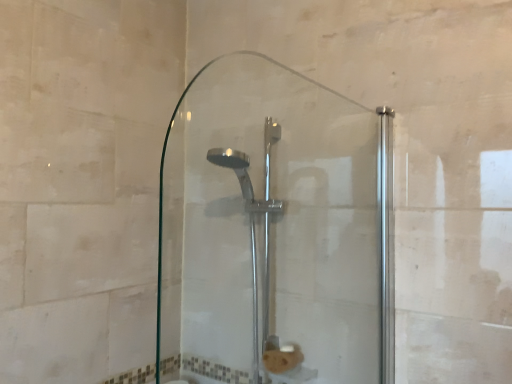
Question: Is the position of clear glass shower door at center more distant than that of polished chrome shower head at center?

Choices:
 (A) no
 (B) yes

Answer: (A)

Question: Could you tell me if clear glass shower door at center is turned towards polished chrome shower head at center?

Choices:
 (A) yes
 (B) no

Answer: (A)

Question: Is clear glass shower door at center next to polished chrome shower head at center and touching it?

Choices:
 (A) yes
 (B) no

Answer: (B)

Question: From a real-world perspective, is clear glass shower door at center physically below polished chrome shower head at center?

Choices:
 (A) no
 (B) yes

Answer: (A)

Question: Is clear glass shower door at center bigger than polished chrome shower head at center?

Choices:
 (A) yes
 (B) no

Answer: (B)

Question: Is clear glass shower door at center smaller than polished chrome shower head at center?

Choices:
 (A) yes
 (B) no

Answer: (A)

Question: Is polished chrome shower head at center not near clear glass shower door at center?

Choices:
 (A) no
 (B) yes

Answer: (A)

Question: Considering the relative positions of polished chrome shower head at center and clear glass shower door at center in the image provided, is polished chrome shower head at center to the left of clear glass shower door at center from the viewer's perspective?

Choices:
 (A) yes
 (B) no

Answer: (A)

Question: Considering the relative sizes of polished chrome shower head at center and clear glass shower door at center in the image provided, is polished chrome shower head at center smaller than clear glass shower door at center?

Choices:
 (A) no
 (B) yes

Answer: (A)

Question: Is polished chrome shower head at center surrounding clear glass shower door at center?

Choices:
 (A) yes
 (B) no

Answer: (B)

Question: From the image's perspective, is polished chrome shower head at center beneath clear glass shower door at center?

Choices:
 (A) no
 (B) yes

Answer: (B)

Question: Can you confirm if polished chrome shower head at center is wider than clear glass shower door at center?

Choices:
 (A) no
 (B) yes

Answer: (B)

Question: Is polished chrome shower head at center to the left or to the right of clear glass shower door at center in the image?

Choices:
 (A) right
 (B) left

Answer: (B)